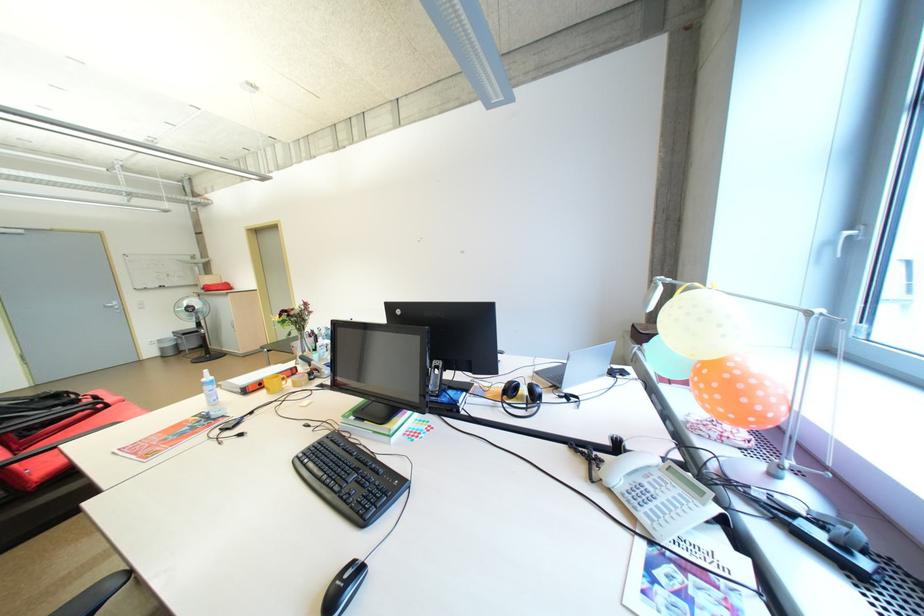
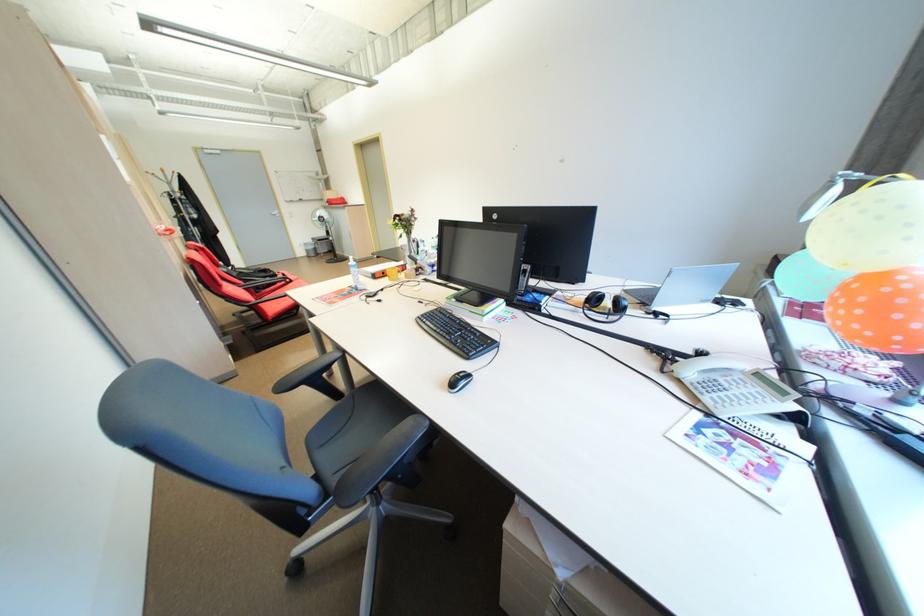
Find the pixel in the second image that matches point 610,456 in the first image.

(687, 359)